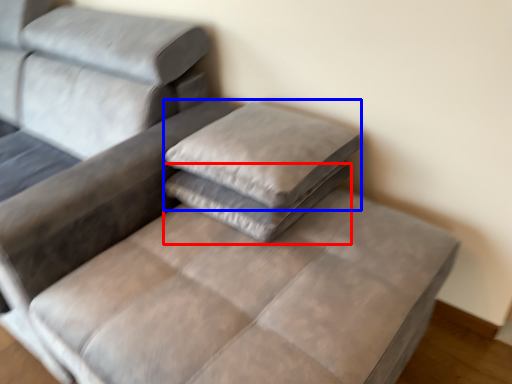
Question: Which point is further to the camera, pillow (highlighted by a red box) or pillow (highlighted by a blue box)?

Choices:
 (A) pillow
 (B) pillow

Answer: (A)